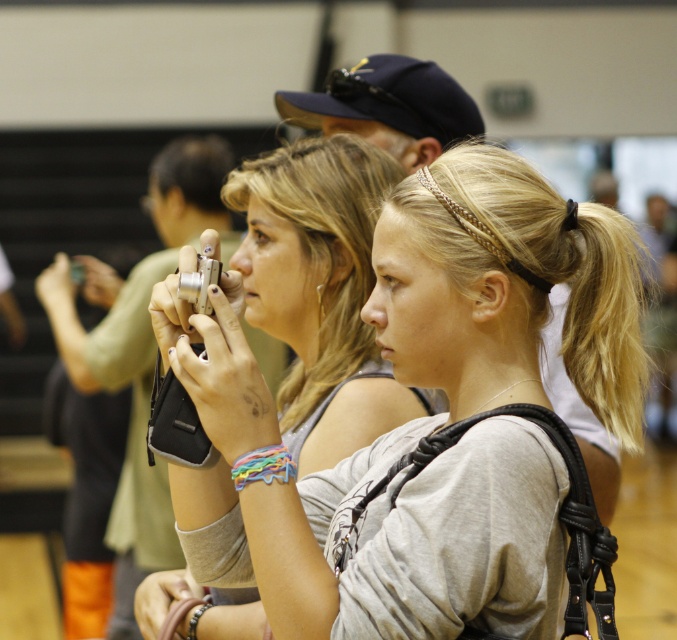
Question: Considering the relative positions of matte silver camera at center and silver metallic camera at center in the image provided, where is matte silver camera at center located with respect to silver metallic camera at center?

Choices:
 (A) above
 (B) below

Answer: (B)

Question: Which point is farther to the camera?

Choices:
 (A) (125, 468)
 (B) (433, 272)

Answer: (A)

Question: Which point appears closest to the camera in this image?

Choices:
 (A) (600, 349)
 (B) (213, 148)

Answer: (A)

Question: Can you confirm if matte silver camera at center is positioned above silver metallic camera at center?

Choices:
 (A) yes
 (B) no

Answer: (B)

Question: Among these objects, which one is farthest from the camera?

Choices:
 (A) silver metallic camera at center
 (B) matte silver camera at center

Answer: (A)

Question: Does matte silver camera at center have a smaller size compared to silver metallic camera at center?

Choices:
 (A) yes
 (B) no

Answer: (A)